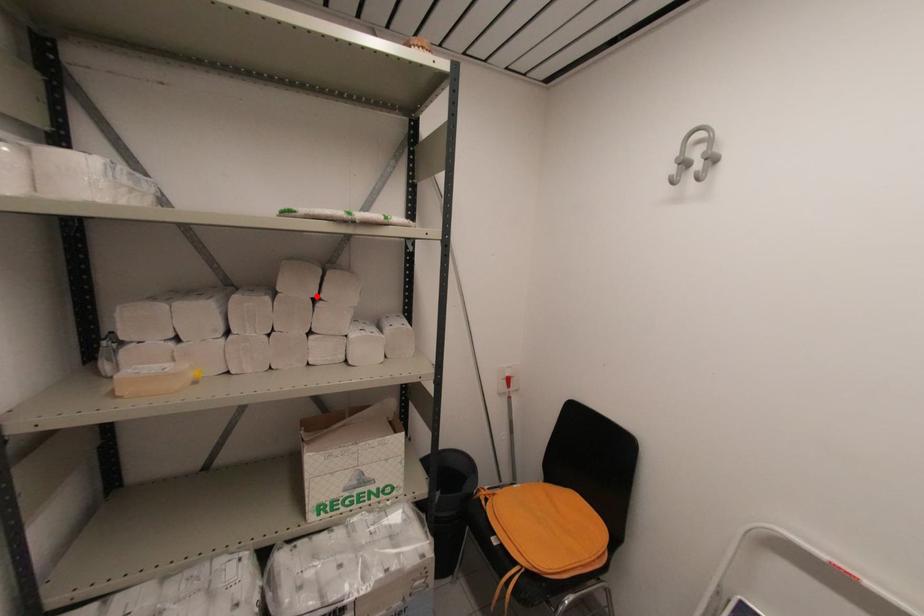
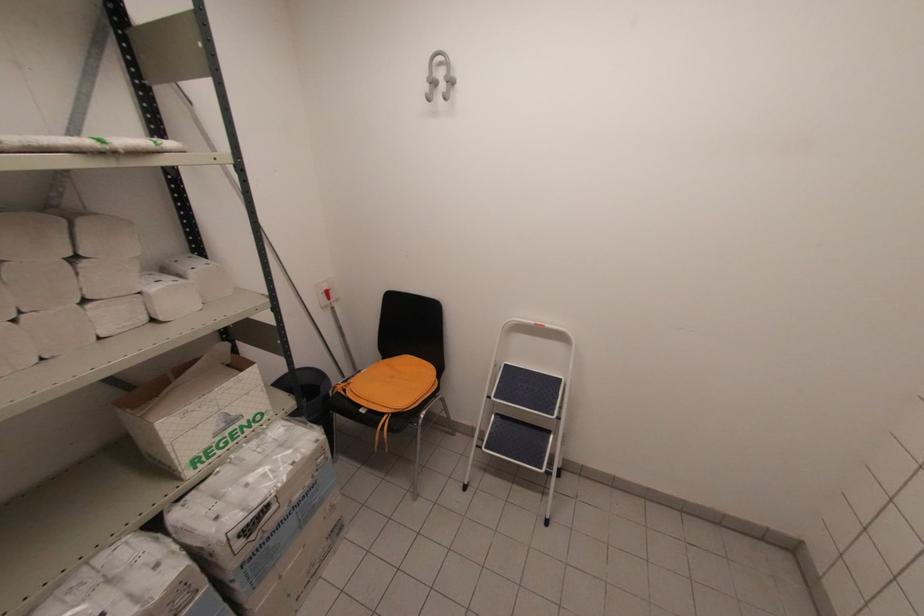
The point at the highlighted location is marked in the first image. Where is the corresponding point in the second image?

(71, 254)